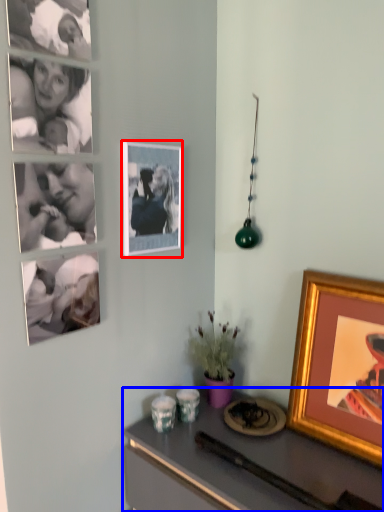
Question: Which of the following is the farthest to the observer, picture frame (highlighted by a red box) or desk (highlighted by a blue box)?

Choices:
 (A) picture frame
 (B) desk

Answer: (A)